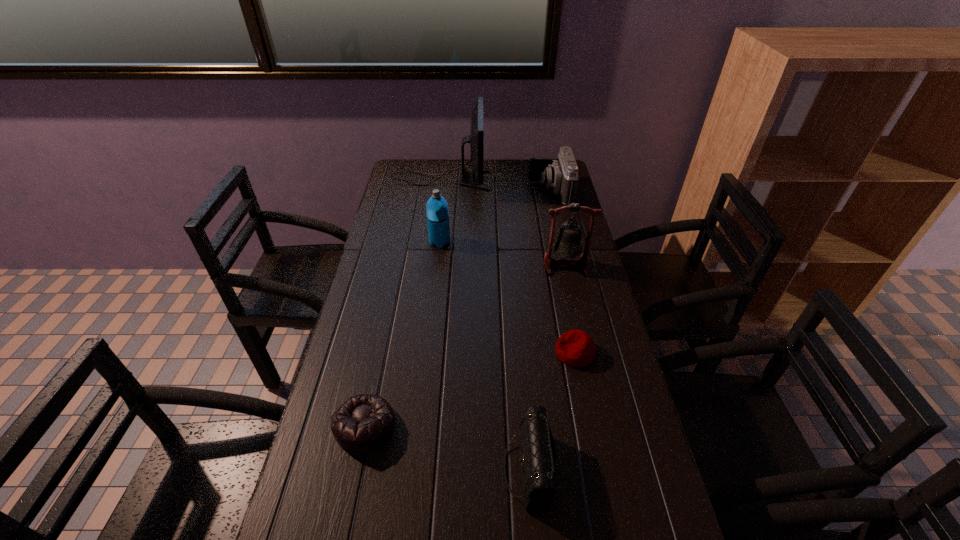
Find the location of a particular element. the tallest object is located at coordinates (476, 138).

The height and width of the screenshot is (540, 960). Find the location of `bell`. bell is located at coordinates (568, 244).

This screenshot has width=960, height=540. Find the location of `the third tallest object`. the third tallest object is located at coordinates (437, 211).

Locate an element on the screen. The height and width of the screenshot is (540, 960). thermos bottle is located at coordinates (437, 211).

At what (x,y) coordinates should I click in order to perform the action: click on the fourth shortest object. Please return your answer as a coordinate pair (x, y). The image size is (960, 540). Looking at the image, I should click on (561, 174).

Locate an element on the screen. the fifth tallest object is located at coordinates (538, 452).

The image size is (960, 540). In order to click on clutch bag in this screenshot , I will do `click(538, 452)`.

Locate an element on the screen. This screenshot has height=540, width=960. the nearer beanbag is located at coordinates (364, 422).

Find the location of a particular element. the right beanbag is located at coordinates (575, 348).

At what (x,y) coordinates should I click in order to perform the action: click on the farther beanbag. Please return your answer as a coordinate pair (x, y). This screenshot has width=960, height=540. Looking at the image, I should click on (575, 348).